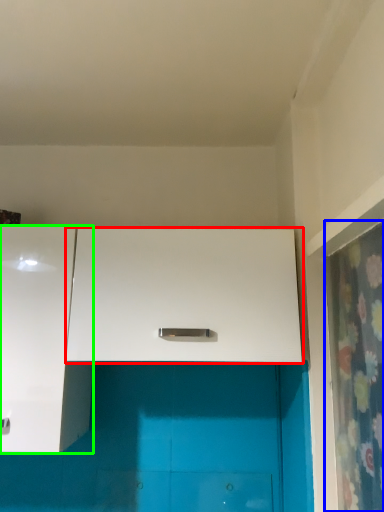
Question: Estimate the real-world distances between objects in this image. Which object is farther from cabinetry (highlighted by a red box), shower curtain (highlighted by a blue box) or cabinetry (highlighted by a green box)?

Choices:
 (A) shower curtain
 (B) cabinetry

Answer: (A)